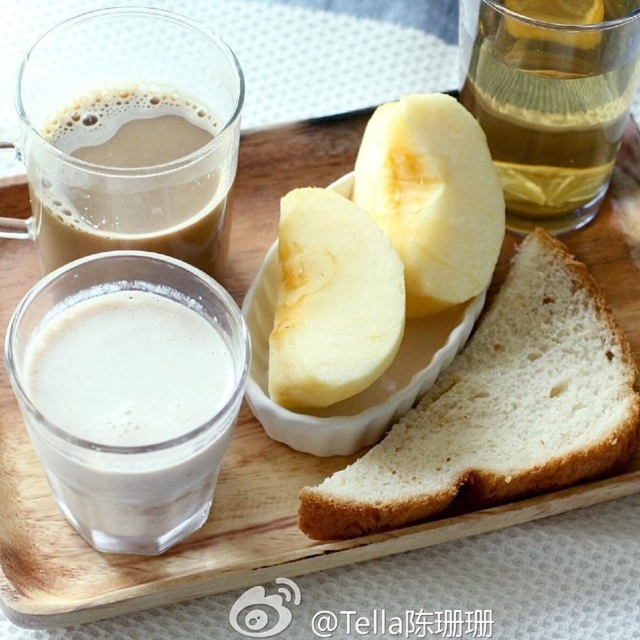
Question: Which object is farther from the camera taking this photo?

Choices:
 (A) white soft bread at center
 (B) translucent glass at upper right
 (C) yellow smooth apple at center

Answer: (B)

Question: Which of the following is the farthest from the observer?

Choices:
 (A) (368, 145)
 (B) (99, 112)
 (C) (33, 392)

Answer: (A)

Question: Can you confirm if white frothy coffee at lower left is positioned to the right of translucent glass at upper right?

Choices:
 (A) yes
 (B) no

Answer: (B)

Question: Does translucent glass at upper right appear on the left side of yellow matte banana at center?

Choices:
 (A) no
 (B) yes

Answer: (A)

Question: Which of these objects is positioned closest to the yellow matte banana at center?

Choices:
 (A) translucent glass at upper right
 (B) yellow smooth apple at center
 (C) white soft bread at center

Answer: (B)

Question: From the image, what is the correct spatial relationship of white frothy coffee at lower left in relation to brown frothy coffee at upper left?

Choices:
 (A) below
 (B) above

Answer: (A)